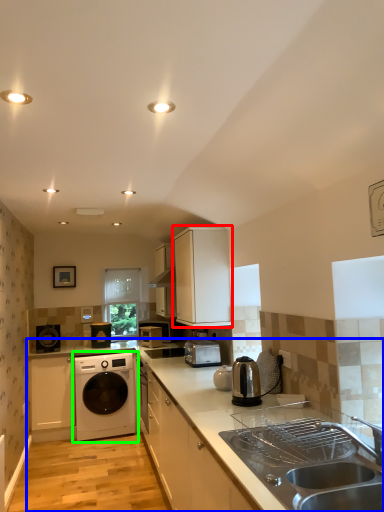
Question: Which object is the closest to the cabinetry (highlighted by a red box)? Choose among these: countertop (highlighted by a blue box) or washing machine (highlighted by a green box).

Choices:
 (A) countertop
 (B) washing machine

Answer: (A)